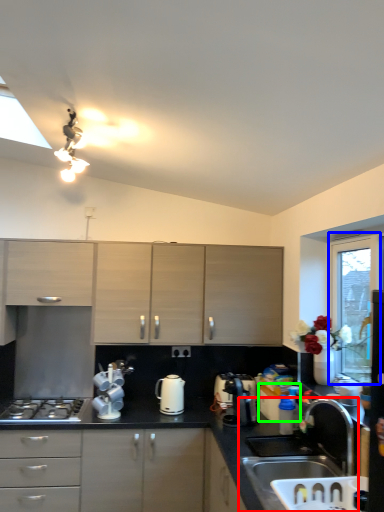
Question: Which object is positioned closest to sink (highlighted by a red box)? Select from window screen (highlighted by a blue box) and appliance (highlighted by a green box).

Choices:
 (A) window screen
 (B) appliance

Answer: (B)